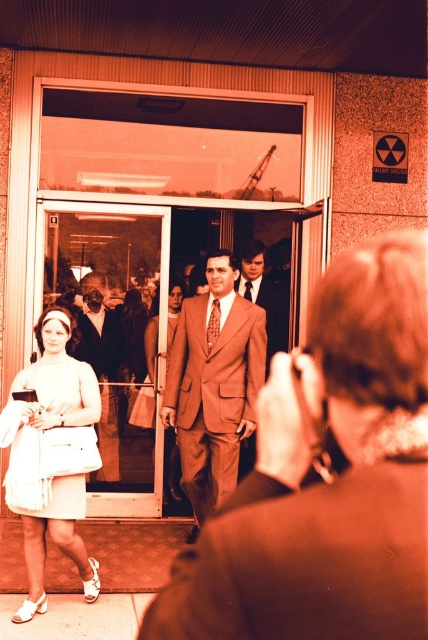
You are a fashion designer analyzing the image. You need to determine which suit, the matte brown suit at center or the satin brown suit at center, is more prominent in the composition. Based on their sizes, which one should you focus on first?

The matte brown suit at center is taller than the satin brown suit at center, so it is more prominent in the composition. You should focus on the matte brown suit at center first.

You are a photographer standing at the camera position in the image. You want to adjust the focus to capture the light beige fabric dress at lower left clearly. If your camera has a maximum focusing range of 3 meters, will you need to move closer to the dress?

The light beige fabric dress at lower left is 3.53 meters away from the camera. Since the camera can only focus up to 3 meters, you need to move closer to the dress to ensure it is in focus.